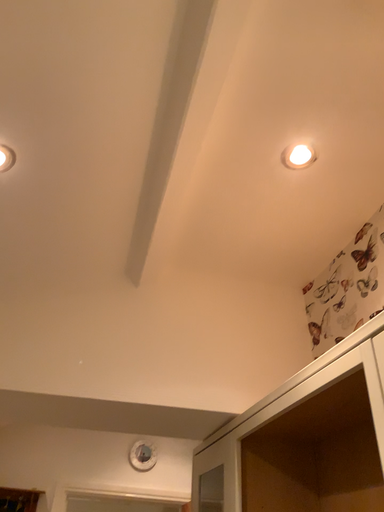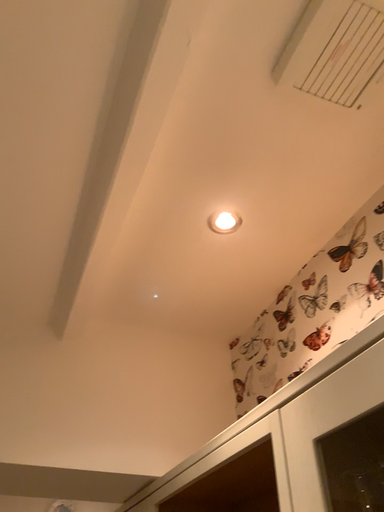
Question: How did the camera likely rotate when shooting the video?

Choices:
 (A) rotated right
 (B) rotated left

Answer: (A)